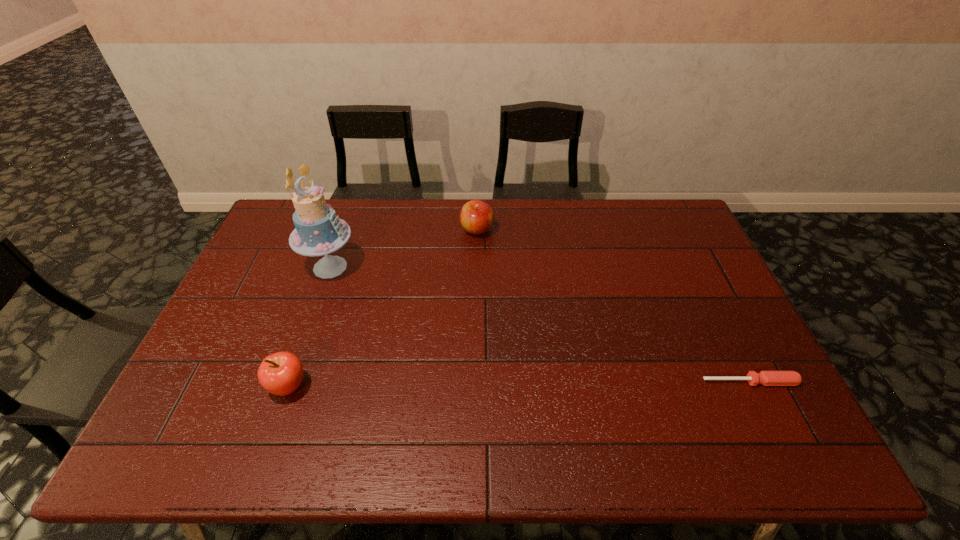
This screenshot has width=960, height=540. I want to click on the left apple, so click(281, 373).

The image size is (960, 540). I want to click on the rightmost object, so click(x=767, y=378).

You are a GUI agent. You are given a task and a screenshot of the screen. Output one action in this format:
    pyautogui.click(x=<x>, y=<y>)
    Task: Click on the shortest object
    The image size is (960, 540).
    Given the screenshot: What is the action you would take?
    pyautogui.click(x=767, y=378)

Find the location of a particular element. The width and height of the screenshot is (960, 540). the tallest object is located at coordinates (318, 231).

At what (x,y) coordinates should I click in order to perform the action: click on cake. Please return your answer as a coordinate pair (x, y). Looking at the image, I should click on (318, 231).

You are a GUI agent. You are given a task and a screenshot of the screen. Output one action in this format:
    pyautogui.click(x=<x>, y=<y>)
    Task: Click on the farther apple
    
    Given the screenshot: What is the action you would take?
    pyautogui.click(x=476, y=216)

The image size is (960, 540). In order to click on the farthest object in this screenshot , I will do `click(476, 216)`.

Image resolution: width=960 pixels, height=540 pixels. I want to click on vacant point located on the back of the nearer apple, so click(325, 281).

You are a GUI agent. You are given a task and a screenshot of the screen. Output one action in this format:
    pyautogui.click(x=<x>, y=<y>)
    Task: Click on the blank space located with a ladder on the side of the cake
    This screenshot has height=540, width=960.
    Given the screenshot: What is the action you would take?
    pyautogui.click(x=412, y=328)

You are a GUI agent. You are given a task and a screenshot of the screen. Output one action in this format:
    pyautogui.click(x=<x>, y=<y>)
    Task: Click on the vacant area located with a ladder on the side of the cake
    This screenshot has height=540, width=960.
    Given the screenshot: What is the action you would take?
    pyautogui.click(x=440, y=349)